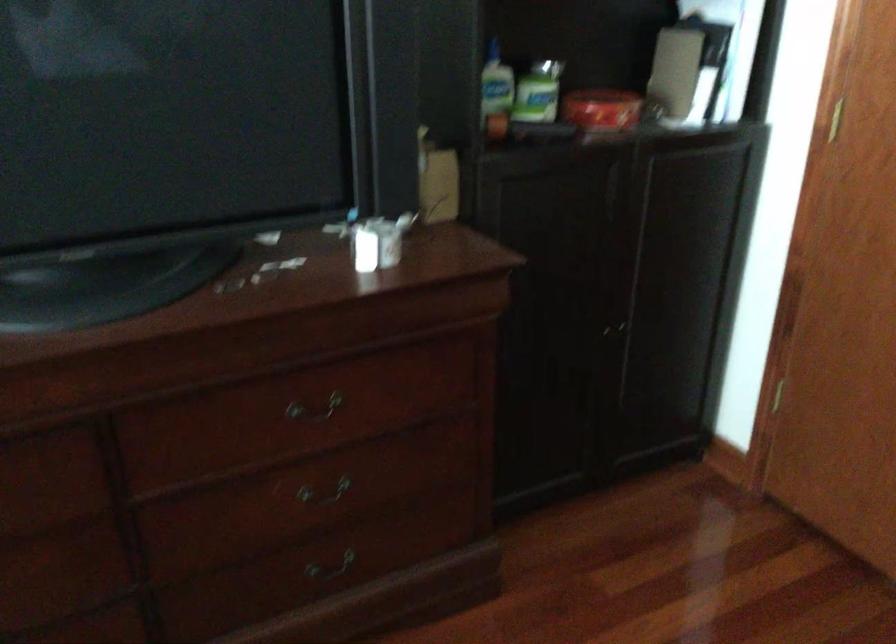
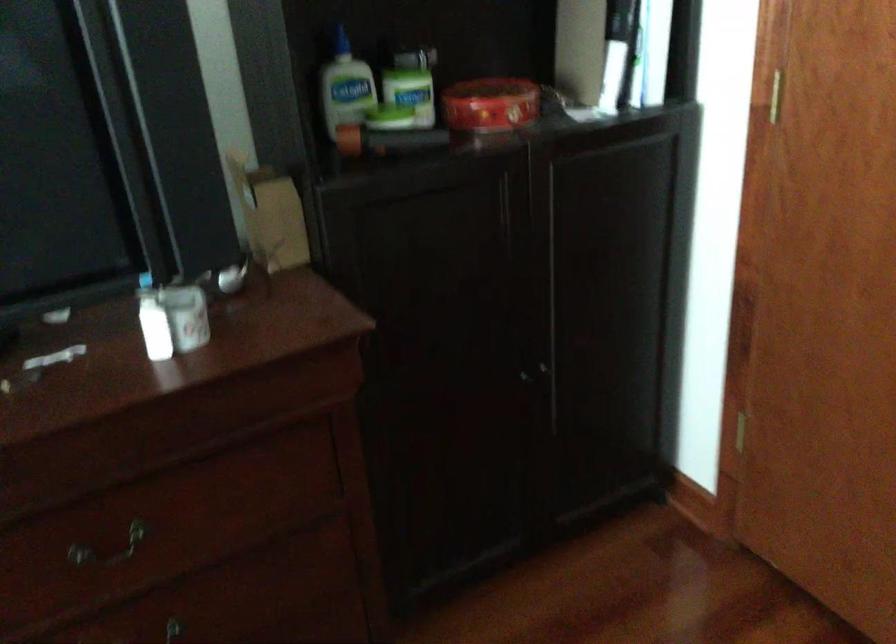
Question: The first image is from the beginning of the video and the second image is from the end. How did the camera likely rotate when shooting the video?

Choices:
 (A) Left
 (B) Right
 (C) Up
 (D) Down

Answer: (B)